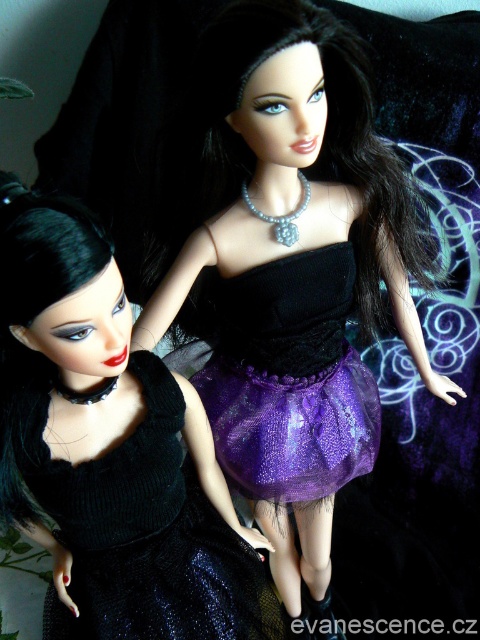
Question: Which point is farther to the camera?

Choices:
 (A) (340, 84)
 (B) (294, 500)
 (C) (85, 611)

Answer: (B)

Question: Which of the following is the closest to the observer?

Choices:
 (A) (220, 326)
 (B) (153, 387)
 (C) (169, 296)

Answer: (B)

Question: Can you confirm if matte black dress at center is bigger than black velvet dress at left?

Choices:
 (A) no
 (B) yes

Answer: (B)

Question: Does black velvet dress at left appear on the left side of purple tulle skirt at center?

Choices:
 (A) yes
 (B) no

Answer: (A)

Question: Is black velvet dress at left closer to the viewer compared to purple tulle skirt at center?

Choices:
 (A) no
 (B) yes

Answer: (B)

Question: Which object appears farthest from the camera in this image?

Choices:
 (A) black velvet dress at left
 (B) matte black dress at center

Answer: (A)